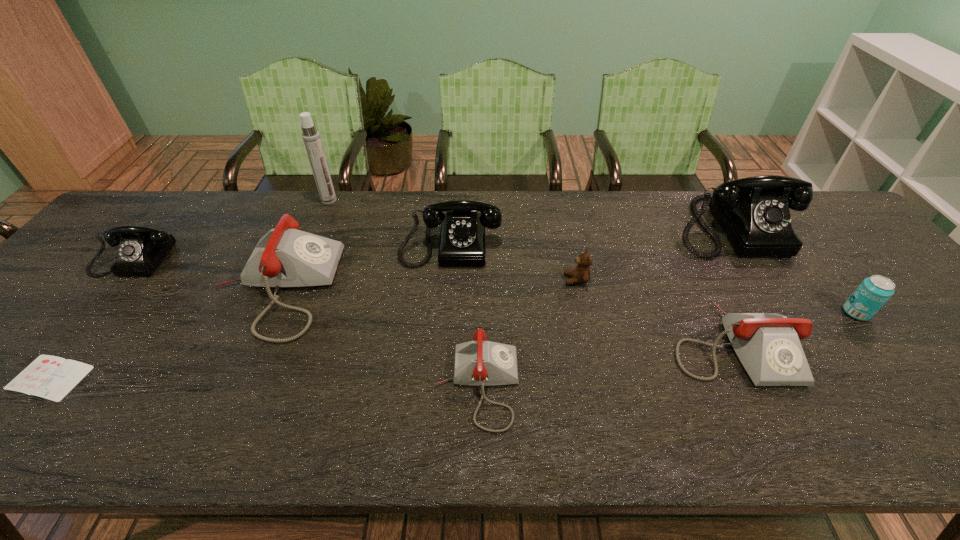
Locate an element on the screen. The image size is (960, 540). aerosol can is located at coordinates (311, 137).

Locate an element on the screen. the tallest object is located at coordinates (311, 137).

What are the coordinates of `the rightmost black telephone` in the screenshot? It's located at (753, 212).

Where is `the biggest black telephone`? the biggest black telephone is located at coordinates (753, 212).

At what (x,y) coordinates should I click in order to perform the action: click on the second black telephone from right to left. Please return your answer as a coordinate pair (x, y). The width and height of the screenshot is (960, 540). Looking at the image, I should click on (462, 242).

This screenshot has height=540, width=960. Find the location of `the third tallest object`. the third tallest object is located at coordinates (462, 242).

You are a GUI agent. You are given a task and a screenshot of the screen. Output one action in this format:
    pyautogui.click(x=<x>, y=<y>)
    Task: Click on the biggest red telephone
    
    Given the screenshot: What is the action you would take?
    pyautogui.click(x=285, y=257)

Identify the location of the leftmost red telephone. (285, 257).

Identify the location of the leftmost telephone. tap(141, 249).

Image resolution: width=960 pixels, height=540 pixels. What are the coordinates of `the smallest black telephone` in the screenshot? It's located at (141, 249).